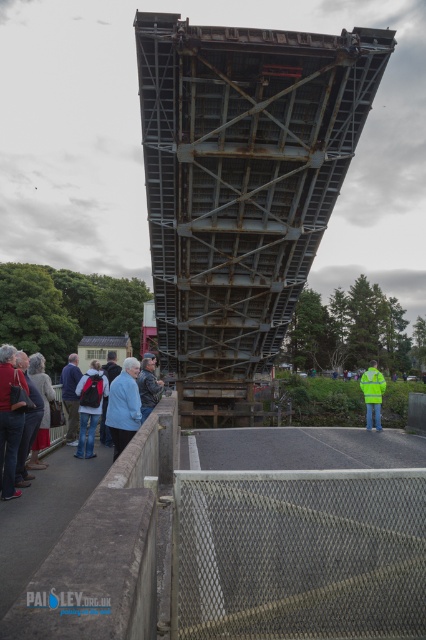
You are standing on the paved walkway and want to take a photo of the rusty metal bridge at center without the blue fabric jacket at center appearing in the frame. Which direction should you move to achieve this?

Move away from the rusty metal bridge at center so that the blue fabric jacket at center is no longer in front of it.

You are standing on the walkway and want to take a photo of the rusty metal bridge at center. If your camera can only focus on objects within a 0.5 unit radius around the point where you are standing, which is at the origin, will the bridge be in focus?

The rusty metal bridge at center is located at point (241, 186). The distance from the origin to this point is sqrt0.292 squared plus 0.568 squared equals approximately 0.636 units. Since 0.636 is greater than 0.5, the bridge will be out of focus.